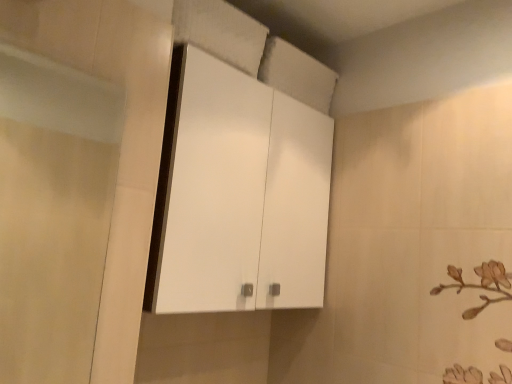
Identify the location of white glossy cabinet at upper center. (238, 195).

The image size is (512, 384). What do you see at coordinates (238, 195) in the screenshot? I see `white glossy cabinet at upper center` at bounding box center [238, 195].

You are a GUI agent. You are given a task and a screenshot of the screen. Output one action in this format:
    pyautogui.click(x=<x>, y=<y>)
    Task: Click on the transparent glass screen door at left
    
    Given the screenshot: What is the action you would take?
    pyautogui.click(x=53, y=214)

Describe the element at coordinates (53, 214) in the screenshot. I see `transparent glass screen door at left` at that location.

Identify the location of white glossy cabinet at upper center. The width and height of the screenshot is (512, 384). (238, 195).

Considering the relative positions of transparent glass screen door at left and white glossy cabinet at upper center in the image provided, is transparent glass screen door at left to the left of white glossy cabinet at upper center from the viewer's perspective?

Yes.

In the image, is transparent glass screen door at left positioned in front of or behind white glossy cabinet at upper center?

Clearly, transparent glass screen door at left is in front of white glossy cabinet at upper center.

Which is closer, (x=0, y=139) or (x=258, y=170)?

Point (x=0, y=139).

From the image's perspective, is transparent glass screen door at left positioned above or below white glossy cabinet at upper center?

Based on their image positions, transparent glass screen door at left is located beneath white glossy cabinet at upper center.

From a real-world perspective, is transparent glass screen door at left located beneath white glossy cabinet at upper center?

Correct, in the physical world, transparent glass screen door at left is lower than white glossy cabinet at upper center.

Is transparent glass screen door at left thinner than white glossy cabinet at upper center?

Yes, transparent glass screen door at left is thinner than white glossy cabinet at upper center.

Is transparent glass screen door at left taller or shorter than white glossy cabinet at upper center?

Clearly, transparent glass screen door at left is shorter compared to white glossy cabinet at upper center.

In the scene shown: Which of these two, transparent glass screen door at left or white glossy cabinet at upper center, is bigger?

white glossy cabinet at upper center is bigger.

Is transparent glass screen door at left situated inside white glossy cabinet at upper center or outside?

transparent glass screen door at left is outside white glossy cabinet at upper center.

Is transparent glass screen door at left directly adjacent to white glossy cabinet at upper center?

No, transparent glass screen door at left is not touching white glossy cabinet at upper center.

Is transparent glass screen door at left facing away from white glossy cabinet at upper center?

No, transparent glass screen door at left is not facing the opposite direction of white glossy cabinet at upper center.

You are a GUI agent. You are given a task and a screenshot of the screen. Output one action in this format:
    pyautogui.click(x=<x>, y=<y>)
    Task: Click on the screen door that is in front of the white glossy cabinet at upper center
    The height and width of the screenshot is (384, 512).
    Given the screenshot: What is the action you would take?
    pyautogui.click(x=53, y=214)

Does white glossy cabinet at upper center appear on the right side of transparent glass screen door at left?

Indeed, white glossy cabinet at upper center is positioned on the right side of transparent glass screen door at left.

Based on the photo, considering the relative positions of white glossy cabinet at upper center and transparent glass screen door at left in the image provided, is white glossy cabinet at upper center in front of transparent glass screen door at left?

No.

Considering the positions of points (152, 249) and (21, 271), is point (152, 249) farther from camera compared to point (21, 271)?

No, it is in front of (21, 271).

From the image's perspective, is white glossy cabinet at upper center above transparent glass screen door at left?

Yes, from the image's perspective, white glossy cabinet at upper center is on top of transparent glass screen door at left.

From a real-world perspective, is white glossy cabinet at upper center positioned under transparent glass screen door at left based on gravity?

Incorrect, from a real-world perspective, white glossy cabinet at upper center is higher than transparent glass screen door at left.

Is white glossy cabinet at upper center wider or thinner than transparent glass screen door at left?

Clearly, white glossy cabinet at upper center has more width compared to transparent glass screen door at left.

Is white glossy cabinet at upper center taller than transparent glass screen door at left?

Correct, white glossy cabinet at upper center is much taller as transparent glass screen door at left.

Who is bigger, white glossy cabinet at upper center or transparent glass screen door at left?

Bigger between the two is white glossy cabinet at upper center.

Would you say transparent glass screen door at left is part of white glossy cabinet at upper center's contents?

That's incorrect, transparent glass screen door at left is not inside white glossy cabinet at upper center.

Is white glossy cabinet at upper center far away from transparent glass screen door at left?

Yes.

Could you tell me if white glossy cabinet at upper center is turned towards transparent glass screen door at left?

No.

What's the angular difference between white glossy cabinet at upper center and transparent glass screen door at left's facing directions?

The angle between the facing direction of white glossy cabinet at upper center and the facing direction of transparent glass screen door at left is 1.09 degrees.

I want to click on screen door lying on the left of white glossy cabinet at upper center, so click(53, 214).

Identify the location of screen door located in front of the white glossy cabinet at upper center. The height and width of the screenshot is (384, 512). (53, 214).

Where is `cabinetry above the transparent glass screen door at left (from the image's perspective)`? cabinetry above the transparent glass screen door at left (from the image's perspective) is located at coordinates (238, 195).